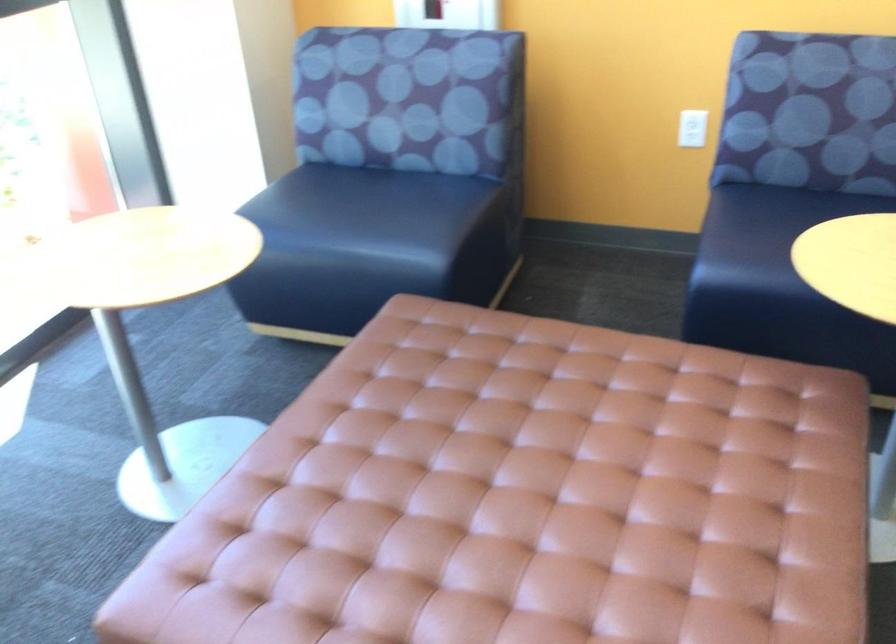
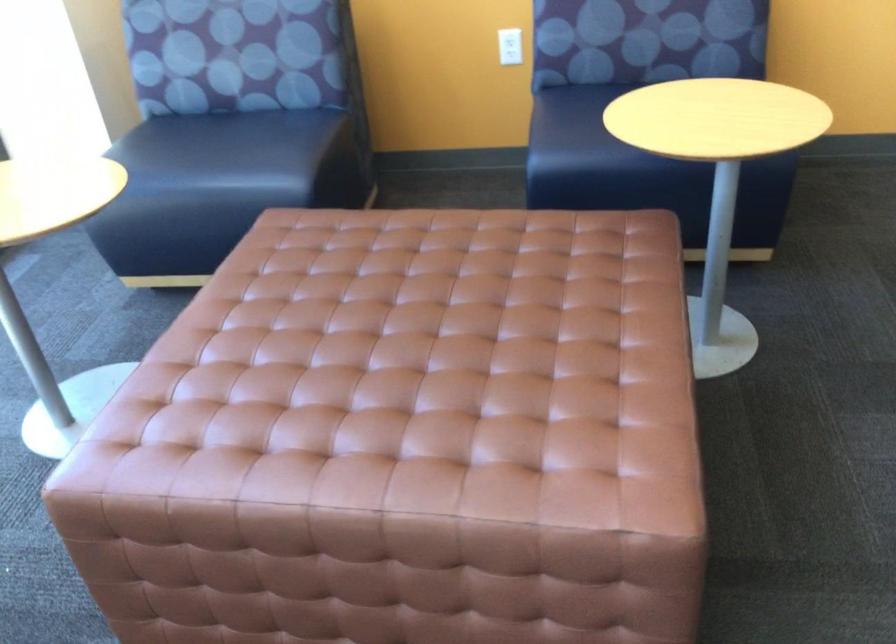
In the second image, find the point that corresponds to (x=693, y=126) in the first image.

(510, 46)